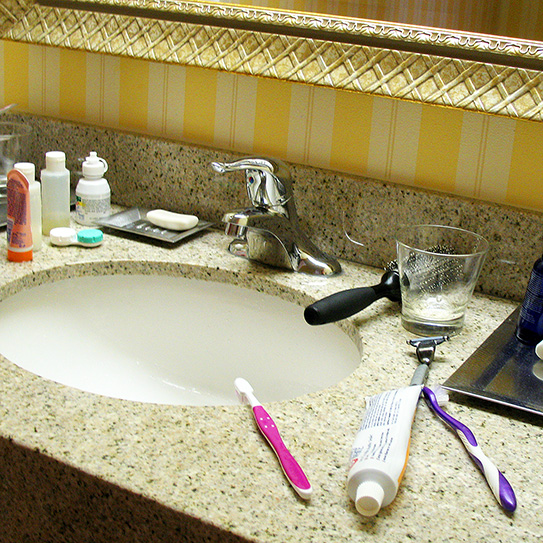
Image resolution: width=543 pixels, height=543 pixels. I want to click on black hairbrush, so click(x=359, y=296).